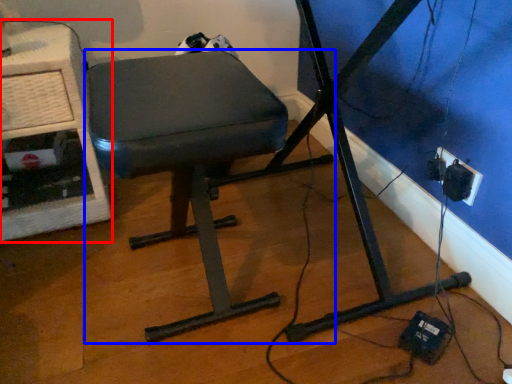
Question: Among these objects, which one is farthest to the camera, computer desk (highlighted by a red box) or furniture (highlighted by a blue box)?

Choices:
 (A) computer desk
 (B) furniture

Answer: (A)